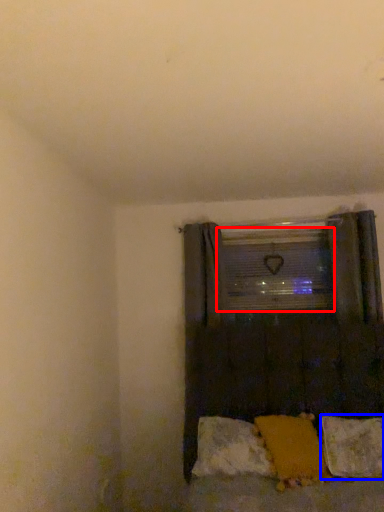
Question: Which object appears closest to the camera in this image, window screen (highlighted by a red box) or pillow (highlighted by a blue box)?

Choices:
 (A) window screen
 (B) pillow

Answer: (B)